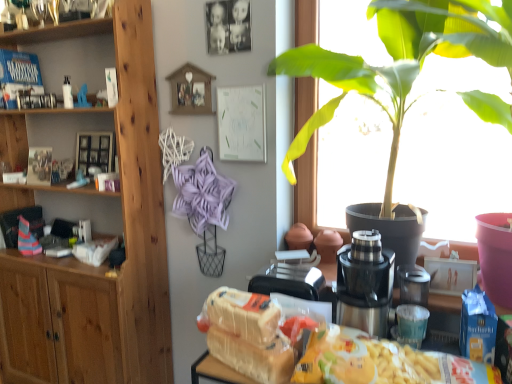
Describe the element at coordinates (398, 62) in the screenshot. I see `green leafy plant at upper right` at that location.

The width and height of the screenshot is (512, 384). Identify the location of translucent plastic bag at lower center. (465, 370).

This screenshot has width=512, height=384. Identify the location of metallic silver coffee machine at center. (365, 284).

Describe the element at coordinates (78, 181) in the screenshot. I see `matte blue toy at left` at that location.

The height and width of the screenshot is (384, 512). Describe the element at coordinates (126, 244) in the screenshot. I see `wooden cabinet at left` at that location.

Measure the distance between point (402, 285) and camera.

Point (402, 285) and camera are 4.99 feet apart from each other.

Find the location of a particular element. Image resolution: width=512 pixels, height=384 pixels. green leafy plant at upper right is located at coordinates (398, 62).

How many degrees apart are the facing directions of satin silver blender at center and wooden cabinet at left?

The angular difference between satin silver blender at center and wooden cabinet at left is 2.41 degrees.

From the image's perspective, is satin silver blender at center on top of wooden cabinet at left?

No.

Is satin silver blender at center to the right of wooden cabinet at left from the viewer's perspective?

Correct, you'll find satin silver blender at center to the right of wooden cabinet at left.

Considering the relative sizes of satin silver blender at center and wooden cabinet at left in the image provided, is satin silver blender at center thinner than wooden cabinet at left?

Indeed, satin silver blender at center has a lesser width compared to wooden cabinet at left.

From a real-world perspective, is satin silver blender at center below green leafy plant at upper right?

Yes, from a real-world perspective, satin silver blender at center is under green leafy plant at upper right.

Is satin silver blender at center smaller than green leafy plant at upper right?

Yes, satin silver blender at center is smaller than green leafy plant at upper right.

Which point is more forward, [426,280] or [346,75]?

The point [426,280] is more forward.

Is satin silver blender at center completely or partially outside of green leafy plant at upper right?

Yes, satin silver blender at center is located beyond the bounds of green leafy plant at upper right.

From a real-world perspective, is translucent plastic bag at lower center above or below wooden cabinet at left?

From a real-world perspective, translucent plastic bag at lower center is physically below wooden cabinet at left.

Considering the sizes of objects translucent plastic bag at lower center and wooden cabinet at left in the image provided, who is thinner, translucent plastic bag at lower center or wooden cabinet at left?

Thinner between the two is translucent plastic bag at lower center.

Is translucent plastic bag at lower center taller than wooden cabinet at left?

In fact, translucent plastic bag at lower center may be shorter than wooden cabinet at left.

From the image's perspective, which one is positioned lower, translucent plastic bag at lower center or wooden cabinet at left?

translucent plastic bag at lower center, from the image's perspective.

This screenshot has height=384, width=512. I want to click on toy on the left of metallic silver coffee machine at center, so click(78, 181).

Looking at the image, does metallic silver coffee machine at center seem bigger or smaller compared to matte blue toy at left?

Considering their sizes, metallic silver coffee machine at center takes up more space than matte blue toy at left.

Can you confirm if metallic silver coffee machine at center is taller than matte blue toy at left?

Yes.

In the scene shown: From a real-world perspective, is metallic silver coffee machine at center physically located above or below matte blue toy at left?

Clearly, from a real-world perspective, metallic silver coffee machine at center is below matte blue toy at left.

Does white bread at center contain wooden cabinet at left?

No.

Does white bread at center have a greater width compared to wooden cabinet at left?

Incorrect, the width of white bread at center does not surpass that of wooden cabinet at left.

Can you confirm if white bread at center is shorter than wooden cabinet at left?

Correct, white bread at center is not as tall as wooden cabinet at left.

From a real-world perspective, between white bread at center and wooden cabinet at left, who is vertically higher?

wooden cabinet at left.

Would you say green leafy plant at upper right is inside or outside white bread at center?

The correct answer is: outside.

From the image's perspective, does green leafy plant at upper right appear higher than white bread at center?

Yes, from the image's perspective, green leafy plant at upper right is on top of white bread at center.

Does green leafy plant at upper right have a larger size compared to white bread at center?

Indeed, green leafy plant at upper right has a larger size compared to white bread at center.

Which is correct: matte blue toy at left is inside green leafy plant at upper right, or outside of it?

matte blue toy at left is spatially situated outside green leafy plant at upper right.

In terms of size, does matte blue toy at left appear bigger or smaller than green leafy plant at upper right?

Clearly, matte blue toy at left is smaller in size than green leafy plant at upper right.

Can you confirm if matte blue toy at left is positioned to the right of green leafy plant at upper right?

In fact, matte blue toy at left is to the left of green leafy plant at upper right.

This screenshot has width=512, height=384. Identify the location of cabinetry to the left of satin silver blender at center. (126, 244).

Where is `appliance located below the green leafy plant at upper right (from the image's perspective)`? The width and height of the screenshot is (512, 384). appliance located below the green leafy plant at upper right (from the image's perspective) is located at coordinates (413, 284).

Looking at the image, which one is located closer to matte blue toy at left, green leafy plant at upper right or wooden cabinet at left?

Among the two, wooden cabinet at left is located nearer to matte blue toy at left.

Based on their spatial positions, is wooden cabinet at left or satin silver blender at center further from translucent plastic bag at lower center?

wooden cabinet at left lies further to translucent plastic bag at lower center than the other object.

Estimate the real-world distances between objects in this image. Which object is further from wooden cabinet at left, translucent plastic bag at lower center or matte blue toy at left?

The object further to wooden cabinet at left is translucent plastic bag at lower center.

From the image, which object appears to be farther from green leafy plant at upper right, white bread at center or matte blue toy at left?

Among the two, matte blue toy at left is located further to green leafy plant at upper right.

When comparing their distances from metallic silver coffee machine at center, does matte blue toy at left or wooden cabinet at left seem closer?

The object closer to metallic silver coffee machine at center is wooden cabinet at left.

When comparing their distances from white bread at center, does satin silver blender at center or wooden cabinet at left seem further?

The object further to white bread at center is wooden cabinet at left.

Which object lies further to the anchor point translucent plastic bag at lower center, white bread at center or green leafy plant at upper right?

green leafy plant at upper right is positioned further to the anchor translucent plastic bag at lower center.

From the image, which object appears to be farther from matte blue toy at left, white bread at center or wooden cabinet at left?

white bread at center lies further to matte blue toy at left than the other object.

Locate an element on the screen. The image size is (512, 384). appliance between matte blue toy at left and green leafy plant at upper right is located at coordinates click(413, 284).

Where is `coffee machine between matte blue toy at left and green leafy plant at upper right from left to right`? coffee machine between matte blue toy at left and green leafy plant at upper right from left to right is located at coordinates (365, 284).

You are a GUI agent. You are given a task and a screenshot of the screen. Output one action in this format:
    pyautogui.click(x=<x>, y=<y>)
    Task: Click on the desk between matte blue toy at left and satin silver blender at center
    Image resolution: width=512 pixels, height=384 pixels.
    Given the screenshot: What is the action you would take?
    pyautogui.click(x=465, y=370)

Identify the location of food between wooden cabinet at left and green leafy plant at upper right from left to right. This screenshot has height=384, width=512. (247, 335).